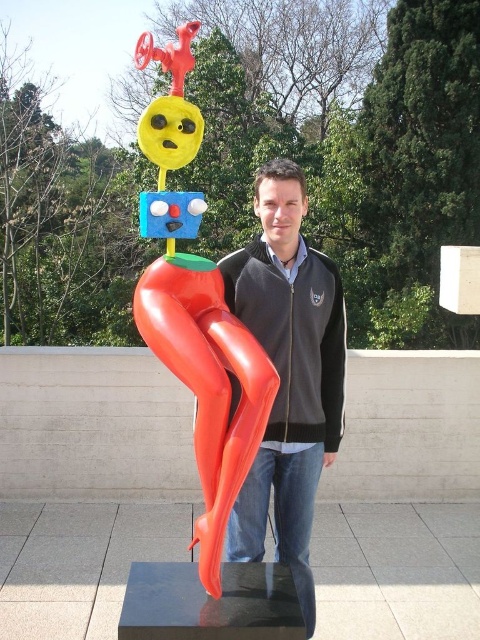
Question: Which point appears farthest from the camera in this image?

Choices:
 (A) (251, 509)
 (B) (216, 349)

Answer: (A)

Question: Which point appears closest to the camera in this image?

Choices:
 (A) 288,262
 (B) 203,566

Answer: (B)

Question: Is matte black jacket at center thinner than rubber-like orange legs at center?

Choices:
 (A) no
 (B) yes

Answer: (A)

Question: Considering the relative positions of matte black jacket at center and rubber-like orange legs at center in the image provided, where is matte black jacket at center located with respect to rubber-like orange legs at center?

Choices:
 (A) right
 (B) left

Answer: (A)

Question: Does matte black jacket at center have a greater width compared to rubber-like orange legs at center?

Choices:
 (A) no
 (B) yes

Answer: (B)